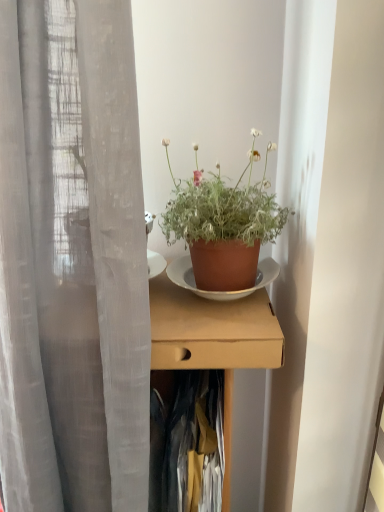
Question: Is dark blue fabric at center shorter than terracotta pot at center?

Choices:
 (A) no
 (B) yes

Answer: (A)

Question: Is dark blue fabric at center wider than terracotta pot at center?

Choices:
 (A) no
 (B) yes

Answer: (B)

Question: Is dark blue fabric at center thinner than terracotta pot at center?

Choices:
 (A) no
 (B) yes

Answer: (A)

Question: Could you tell me if dark blue fabric at center is facing terracotta pot at center?

Choices:
 (A) no
 (B) yes

Answer: (A)

Question: Would you say terracotta pot at center is part of dark blue fabric at center's contents?

Choices:
 (A) yes
 (B) no

Answer: (B)

Question: Is dark blue fabric at center bigger than terracotta pot at center?

Choices:
 (A) no
 (B) yes

Answer: (B)

Question: Considering the relative sizes of brown cardboard box at center and dark blue fabric at center in the image provided, is brown cardboard box at center bigger than dark blue fabric at center?

Choices:
 (A) yes
 (B) no

Answer: (A)

Question: From the image's perspective, does brown cardboard box at center appear higher than dark blue fabric at center?

Choices:
 (A) yes
 (B) no

Answer: (A)

Question: Is the depth of brown cardboard box at center less than that of dark blue fabric at center?

Choices:
 (A) no
 (B) yes

Answer: (B)

Question: From the image's perspective, would you say brown cardboard box at center is shown under dark blue fabric at center?

Choices:
 (A) no
 (B) yes

Answer: (A)

Question: Are brown cardboard box at center and dark blue fabric at center located far from each other?

Choices:
 (A) no
 (B) yes

Answer: (A)

Question: Does brown cardboard box at center come behind dark blue fabric at center?

Choices:
 (A) no
 (B) yes

Answer: (A)

Question: Is brown cardboard box at center taller than terracotta pot at center?

Choices:
 (A) no
 (B) yes

Answer: (B)